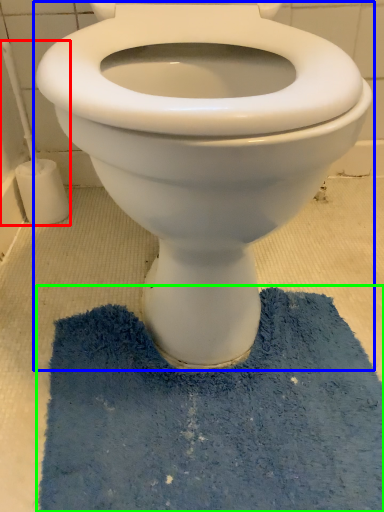
Question: Which object is positioned closest to brush (highlighted by a red box)? Select from toilet (highlighted by a blue box) and bath mat (highlighted by a green box).

Choices:
 (A) toilet
 (B) bath mat

Answer: (A)